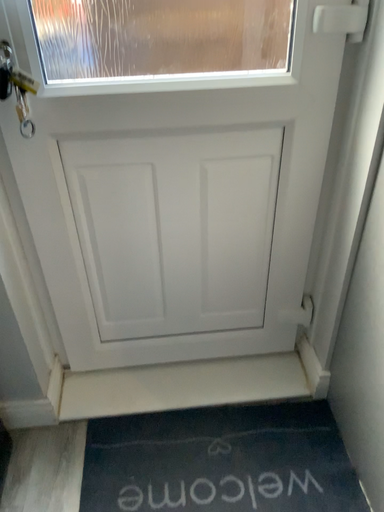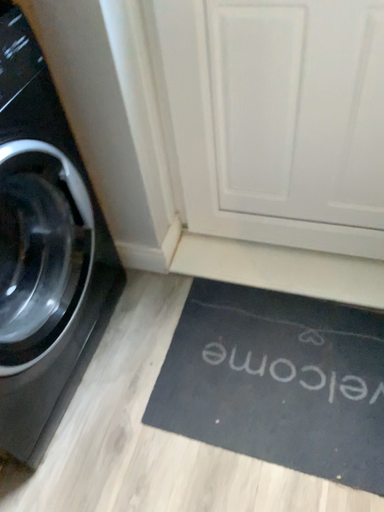
Question: Which way did the camera rotate in the video?

Choices:
 (A) rotated right
 (B) rotated left

Answer: (B)